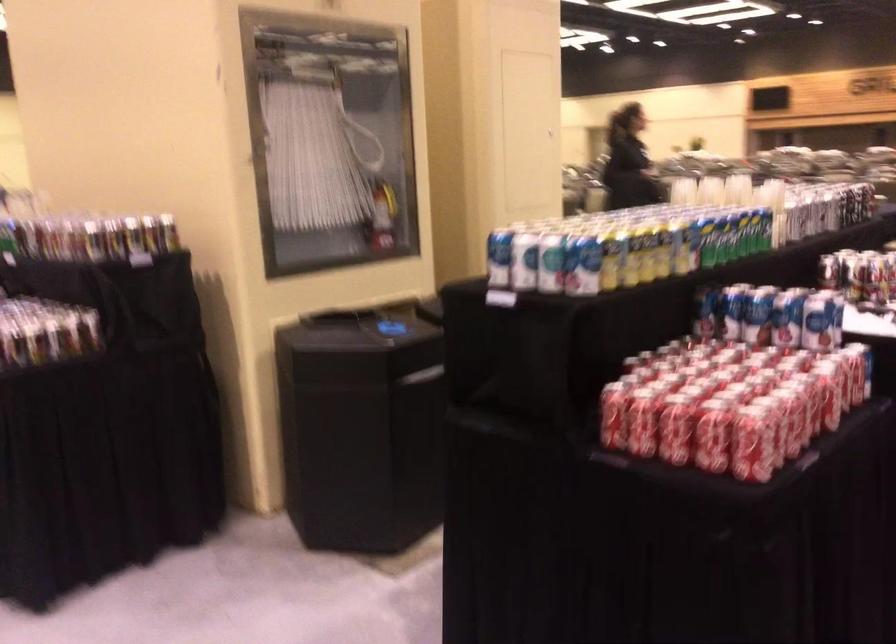
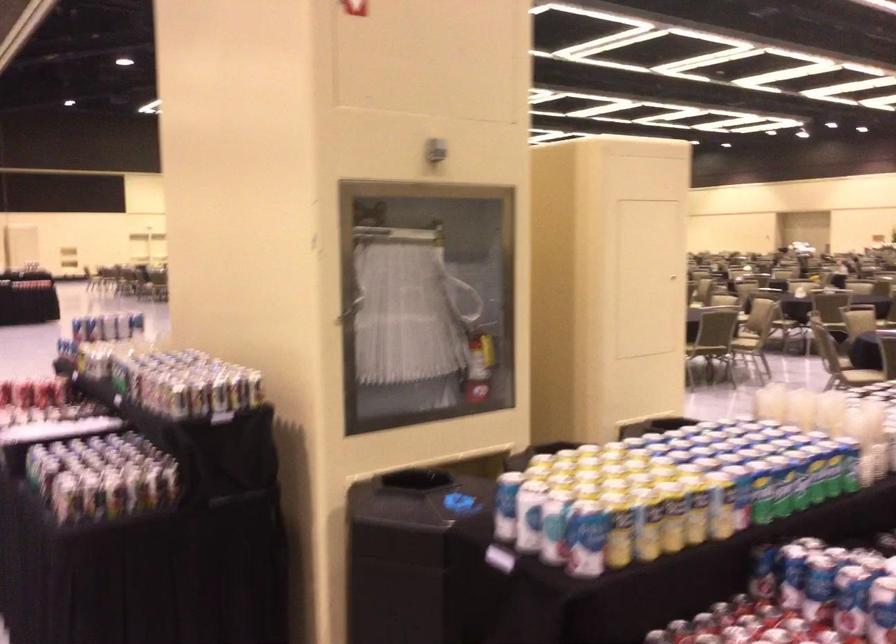
The point at (383,212) is marked in the first image. Where is the corresponding point in the second image?

(478, 365)